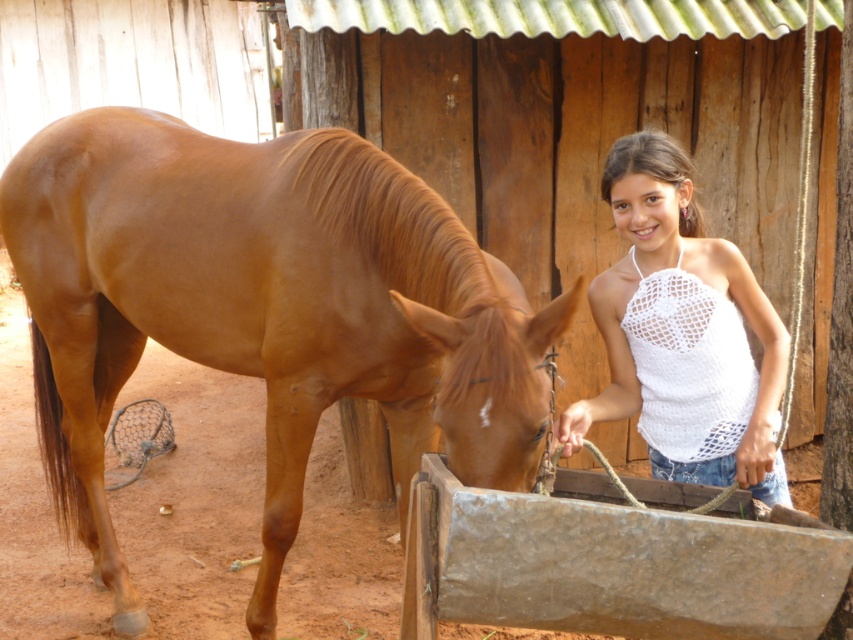
Consider the image. Between brown glossy horse at left and white crochet tank top at center, which one is positioned lower?

brown glossy horse at left is lower down.

Is the position of brown glossy horse at left less distant than that of white crochet tank top at center?

Yes, it is.

In order to click on brown glossy horse at left in this screenshot , I will do `click(263, 310)`.